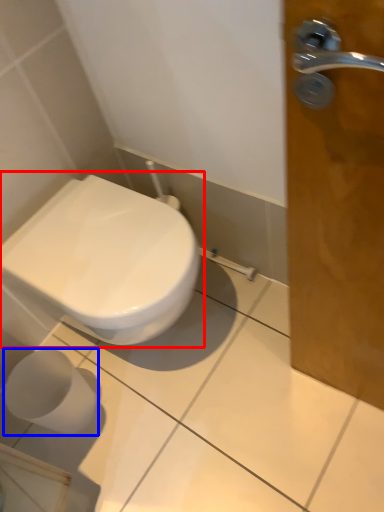
Question: Which point is further to the camera, toilet (highlighted by a red box) or toilet paper (highlighted by a blue box)?

Choices:
 (A) toilet
 (B) toilet paper

Answer: (B)